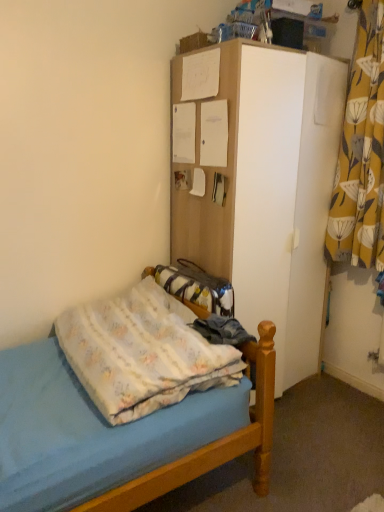
Question: Should I look upward or downward to see fluffy cotton blanket at lower left?

Choices:
 (A) up
 (B) down

Answer: (B)

Question: Is yellow floral fabric curtain at right bigger than fluffy cotton blanket at lower left?

Choices:
 (A) yes
 (B) no

Answer: (B)

Question: Is fluffy cotton blanket at lower left located within yellow floral fabric curtain at right?

Choices:
 (A) no
 (B) yes

Answer: (A)

Question: Is the position of yellow floral fabric curtain at right less distant than that of fluffy cotton blanket at lower left?

Choices:
 (A) yes
 (B) no

Answer: (B)

Question: Is yellow floral fabric curtain at right oriented away from fluffy cotton blanket at lower left?

Choices:
 (A) yes
 (B) no

Answer: (B)

Question: Can you confirm if yellow floral fabric curtain at right is positioned to the left of fluffy cotton blanket at lower left?

Choices:
 (A) no
 (B) yes

Answer: (A)

Question: Are yellow floral fabric curtain at right and fluffy cotton blanket at lower left located far from each other?

Choices:
 (A) no
 (B) yes

Answer: (B)

Question: Could you tell me if white matte cabinet at upper center is turned towards fluffy cotton blanket at lower left?

Choices:
 (A) no
 (B) yes

Answer: (A)

Question: Does white matte cabinet at upper center contain fluffy cotton blanket at lower left?

Choices:
 (A) no
 (B) yes

Answer: (A)

Question: Is white matte cabinet at upper center at the right side of fluffy cotton blanket at lower left?

Choices:
 (A) yes
 (B) no

Answer: (A)

Question: Can we say white matte cabinet at upper center lies outside fluffy cotton blanket at lower left?

Choices:
 (A) yes
 (B) no

Answer: (A)

Question: Is white matte cabinet at upper center touching fluffy cotton blanket at lower left?

Choices:
 (A) no
 (B) yes

Answer: (A)

Question: Considering the relative sizes of white matte cabinet at upper center and fluffy cotton blanket at lower left in the image provided, is white matte cabinet at upper center bigger than fluffy cotton blanket at lower left?

Choices:
 (A) no
 (B) yes

Answer: (B)

Question: Can you confirm if yellow floral fabric curtain at right is smaller than white matte cabinet at upper center?

Choices:
 (A) yes
 (B) no

Answer: (A)